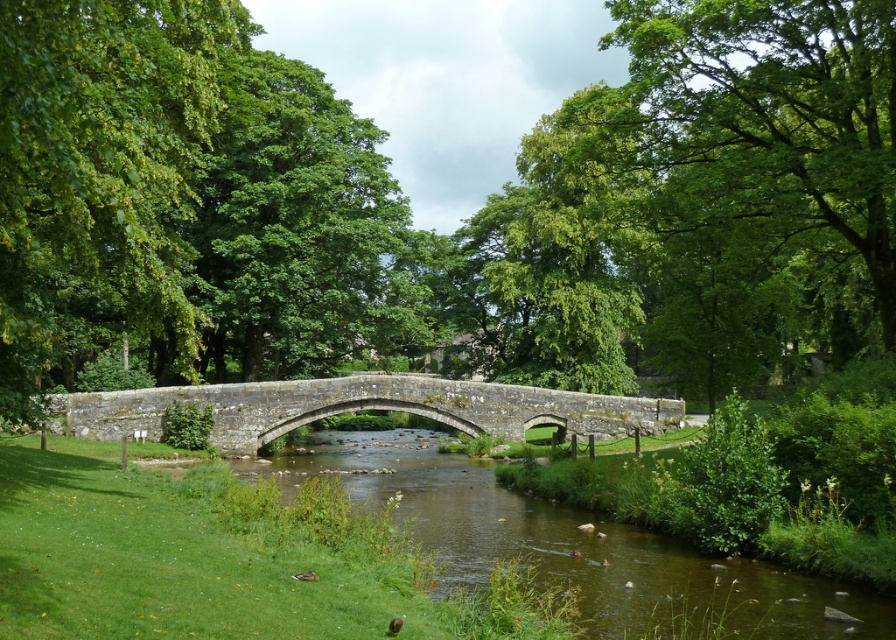
From the picture: You are a hiker standing on the stone bridge and want to rest under the shade of the widest tree. Which tree should you choose between the green leafy tree at center and the green leafy tree at left?

The green leafy tree at center might be wider than green leafy tree at left, so you should choose the green leafy tree at center for the widest shade.

You are a hiker planning to cross the stone bridge at center. You notice a green leafy tree at center nearby. How far apart are these two landmarks?

The distance between the green leafy tree at center and the stone bridge at center is 15.85 meters.

You are standing on the stone bridge and looking towards the river. You see a green leafy tree at center and a green leafy tree at left. Which tree is closer to you?

The green leafy tree at center is closer to you because the green leafy tree at left is behind it.